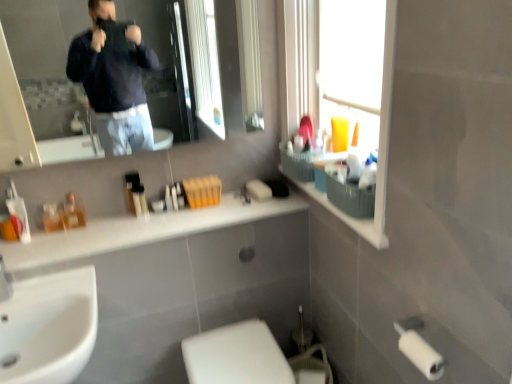
Question: Is white glossy sink at lower left further to camera compared to translucent plastic basket at upper right?

Choices:
 (A) no
 (B) yes

Answer: (B)

Question: Does white glossy sink at lower left have a lesser height compared to translucent plastic basket at upper right?

Choices:
 (A) yes
 (B) no

Answer: (A)

Question: Is translucent plastic basket at upper right completely or partially inside white glossy sink at lower left?

Choices:
 (A) yes
 (B) no

Answer: (B)

Question: From a real-world perspective, is white glossy sink at lower left beneath translucent plastic basket at upper right?

Choices:
 (A) no
 (B) yes

Answer: (B)

Question: Does white glossy sink at lower left come in front of translucent plastic basket at upper right?

Choices:
 (A) no
 (B) yes

Answer: (A)

Question: Considering the positions of point (380, 49) and point (308, 71), is point (380, 49) closer or farther from the camera than point (308, 71)?

Choices:
 (A) farther
 (B) closer

Answer: (B)

Question: Relative to translucent plastic basket at upper right, is transparent plastic window screen at upper right in front or behind?

Choices:
 (A) behind
 (B) front

Answer: (A)

Question: In terms of width, does transparent plastic window screen at upper right look wider or thinner when compared to translucent plastic basket at upper right?

Choices:
 (A) thin
 (B) wide

Answer: (B)

Question: From the image's perspective, is transparent plastic window screen at upper right located above or below translucent plastic basket at upper right?

Choices:
 (A) above
 (B) below

Answer: (A)

Question: In terms of width, does transparent plastic window screen at upper right look wider or thinner when compared to white matte soap at center?

Choices:
 (A) wide
 (B) thin

Answer: (A)

Question: Relative to white matte soap at center, is transparent plastic window screen at upper right in front or behind?

Choices:
 (A) behind
 (B) front

Answer: (B)

Question: Considering the positions of transparent plastic window screen at upper right and white matte soap at center in the image, is transparent plastic window screen at upper right taller or shorter than white matte soap at center?

Choices:
 (A) short
 (B) tall

Answer: (B)

Question: From the image's perspective, relative to white matte soap at center, is transparent plastic window screen at upper right above or below?

Choices:
 (A) below
 (B) above

Answer: (B)

Question: In the image, is white glossy toilet at lower center positioned in front of or behind white matte soap at center?

Choices:
 (A) front
 (B) behind

Answer: (A)

Question: From a real-world perspective, is white glossy toilet at lower center physically located above or below white matte soap at center?

Choices:
 (A) below
 (B) above

Answer: (A)